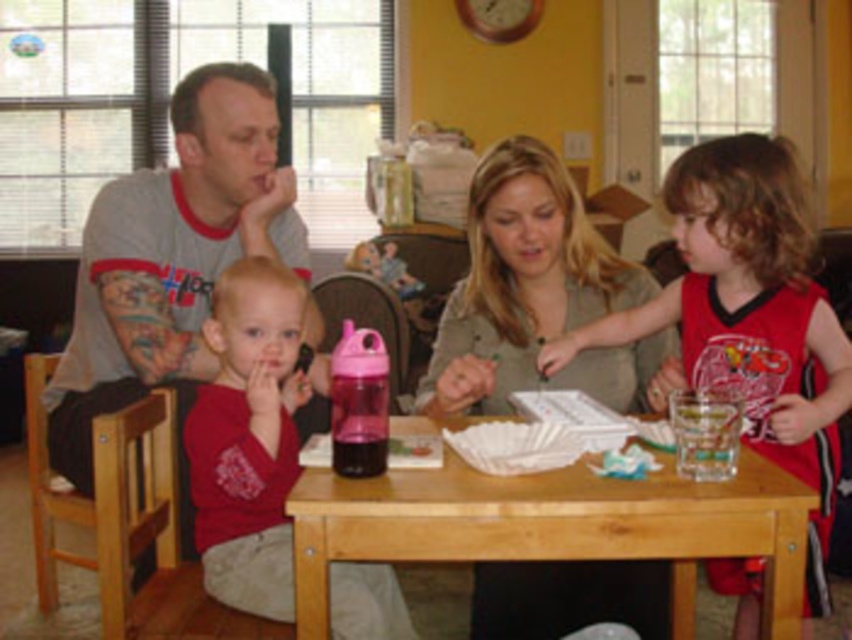
Between red jersey shirt at right and wooden table at center, which one has less height?

wooden table at center is shorter.

You are a GUI agent. You are given a task and a screenshot of the screen. Output one action in this format:
    pyautogui.click(x=<x>, y=<y>)
    Task: Click on the red jersey shirt at right
    
    Given the screenshot: What is the action you would take?
    pyautogui.click(x=749, y=316)

The height and width of the screenshot is (640, 852). I want to click on red jersey shirt at right, so click(749, 316).

Identify the location of red jersey shirt at right. The image size is (852, 640). (749, 316).

Can you confirm if gray cotton t-shirt at left is positioned above matte gray shirt at center?

Correct, gray cotton t-shirt at left is located above matte gray shirt at center.

How much distance is there between gray cotton t-shirt at left and matte gray shirt at center?

gray cotton t-shirt at left is 59.08 centimeters away from matte gray shirt at center.

Measure the distance between point (199, 220) and camera.

A distance of 2.21 meters exists between point (199, 220) and camera.

Locate an element on the screen. gray cotton t-shirt at left is located at coordinates (171, 257).

Can you confirm if matte gray shirt at center is positioned to the right of matte red shirt at center?

Indeed, matte gray shirt at center is positioned on the right side of matte red shirt at center.

Can you confirm if matte gray shirt at center is shorter than matte red shirt at center?

Yes, matte gray shirt at center is shorter than matte red shirt at center.

Identify the location of matte gray shirt at center. (534, 294).

At what (x,y) coordinates should I click in order to perform the action: click on matte gray shirt at center. Please return your answer as a coordinate pair (x, y). The image size is (852, 640). Looking at the image, I should click on (534, 294).